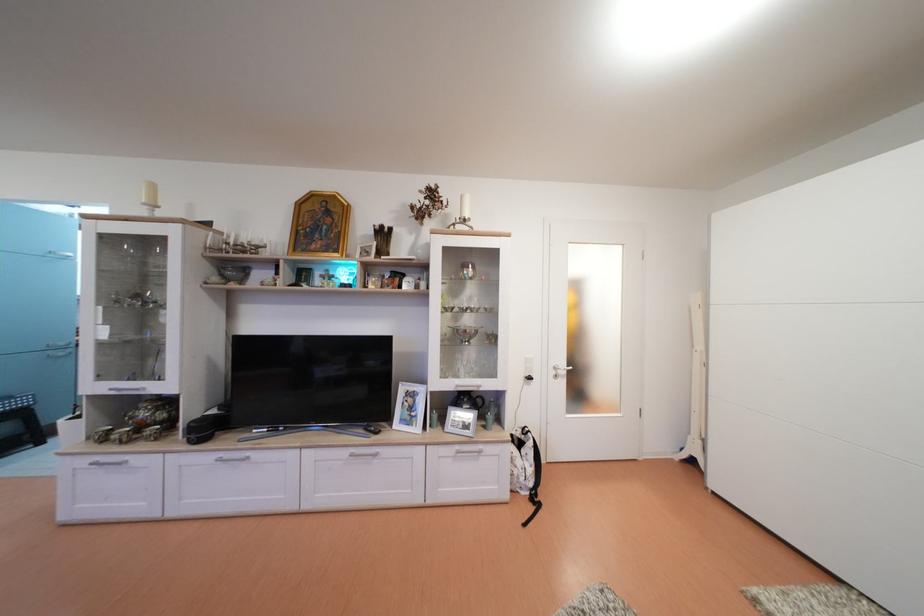
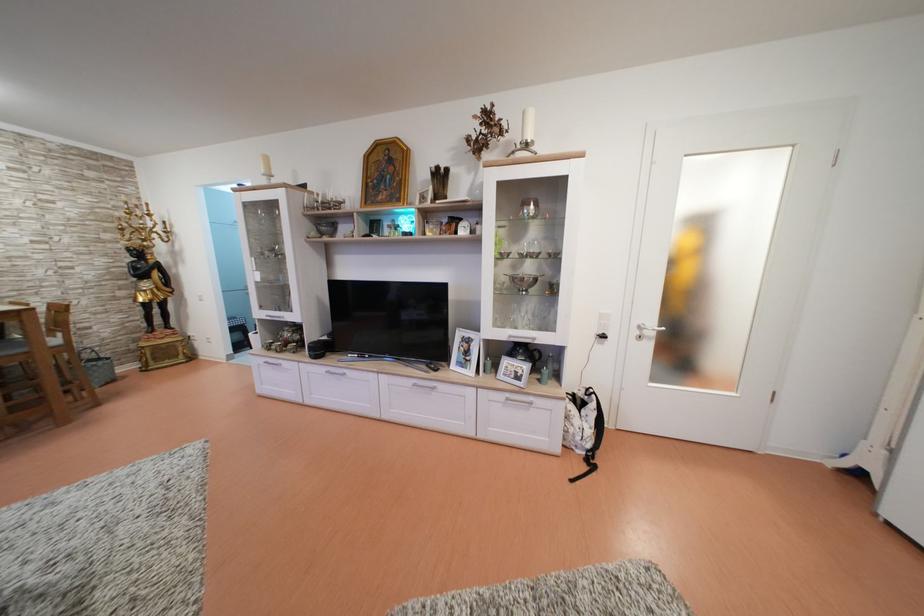
Find the pixel in the second image that matches point (472, 405) in the first image.

(528, 357)